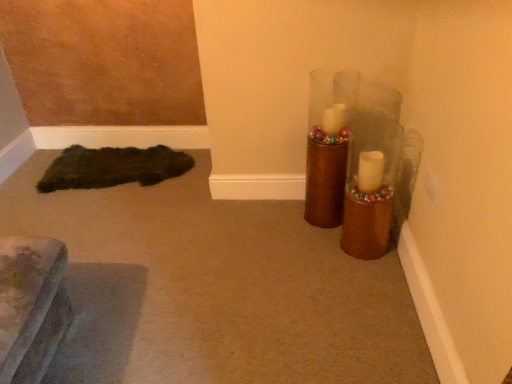
Question: Is dark fuzzy rug at lower left bigger than shiny brown vase at upper right?

Choices:
 (A) yes
 (B) no

Answer: (B)

Question: Is dark fuzzy rug at lower left far from shiny brown vase at upper right?

Choices:
 (A) no
 (B) yes

Answer: (B)

Question: From the image's perspective, is dark fuzzy rug at lower left under shiny brown vase at upper right?

Choices:
 (A) no
 (B) yes

Answer: (B)

Question: Is dark fuzzy rug at lower left placed right next to shiny brown vase at upper right?

Choices:
 (A) yes
 (B) no

Answer: (B)

Question: From a real-world perspective, is dark fuzzy rug at lower left located higher than shiny brown vase at upper right?

Choices:
 (A) yes
 (B) no

Answer: (B)

Question: Does dark fuzzy rug at lower left appear on the left side of shiny brown vase at upper right?

Choices:
 (A) yes
 (B) no

Answer: (A)

Question: From the image's perspective, does shiny brown vase at upper right appear lower than dark fuzzy rug at lower left?

Choices:
 (A) yes
 (B) no

Answer: (B)

Question: Is shiny brown vase at upper right bigger than dark fuzzy rug at lower left?

Choices:
 (A) yes
 (B) no

Answer: (A)

Question: Considering the relative sizes of shiny brown vase at upper right and dark fuzzy rug at lower left in the image provided, is shiny brown vase at upper right thinner than dark fuzzy rug at lower left?

Choices:
 (A) no
 (B) yes

Answer: (B)

Question: Is shiny brown vase at upper right directly adjacent to dark fuzzy rug at lower left?

Choices:
 (A) no
 (B) yes

Answer: (A)

Question: From a real-world perspective, is shiny brown vase at upper right on dark fuzzy rug at lower left?

Choices:
 (A) no
 (B) yes

Answer: (B)

Question: Is shiny brown vase at upper right positioned beyond the bounds of dark fuzzy rug at lower left?

Choices:
 (A) yes
 (B) no

Answer: (A)

Question: Is dark fuzzy rug at lower left bigger or smaller than shiny brown vase at upper right?

Choices:
 (A) big
 (B) small

Answer: (B)